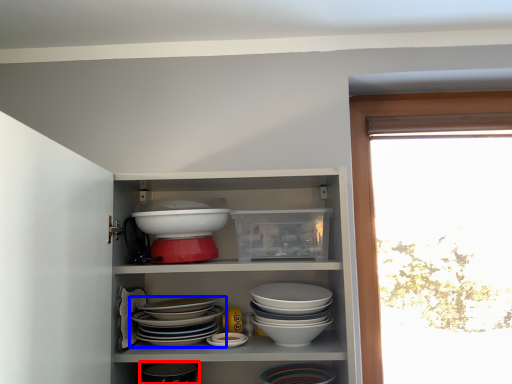
Question: Which object is further to the camera taking this photo, tableware (highlighted by a red box) or bowl (highlighted by a blue box)?

Choices:
 (A) tableware
 (B) bowl

Answer: (A)